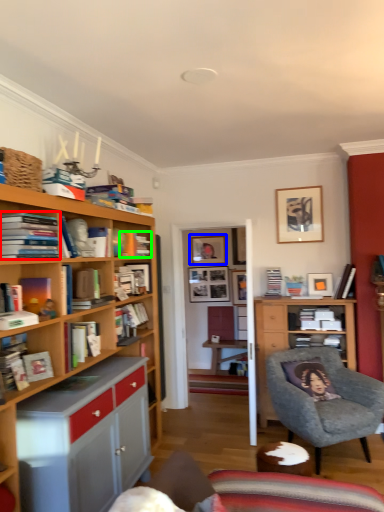
Question: Based on their relative distances, which object is nearer to book (highlighted by a red box)? Choose from picture frame (highlighted by a blue box) and book (highlighted by a green box).

Choices:
 (A) picture frame
 (B) book

Answer: (B)